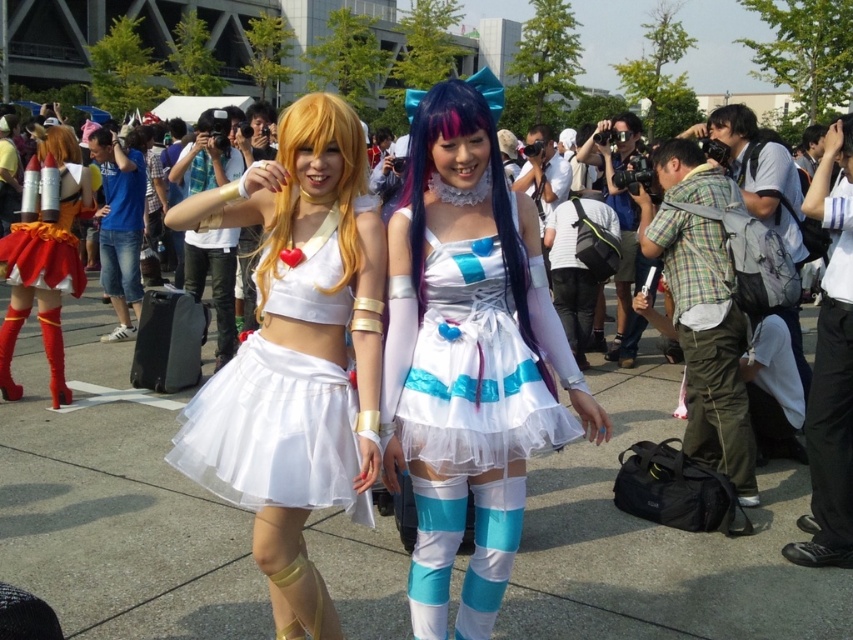
Is shiny metallic rocket at left closer to camera compared to matte red thigh-high boot at lower left?

Yes.

Is point (32, 292) positioned in front of point (51, 384)?

Yes, it is.

I want to click on shiny metallic rocket at left, so click(x=45, y=259).

Can you confirm if white satin skirt at center is bigger than shiny metallic rocket at left?

Indeed, white satin skirt at center has a larger size compared to shiny metallic rocket at left.

Is white satin skirt at center wider than shiny metallic rocket at left?

Yes.

I want to click on white satin skirt at center, so click(x=296, y=355).

Locate an element on the screen. This screenshot has height=640, width=853. white satin skirt at center is located at coordinates (296, 355).

You are a GUI agent. You are given a task and a screenshot of the screen. Output one action in this format:
    pyautogui.click(x=<x>, y=<y>)
    Task: Click on the white tulle dress at center
    
    Given the screenshot: What is the action you would take?
    pyautogui.click(x=473, y=360)